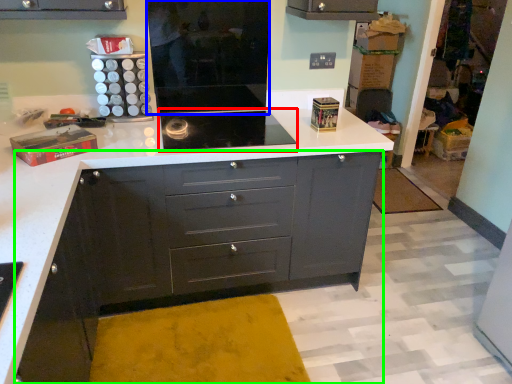
Question: Which object is the farthest from home appliance (highlighted by a red box)? Choose among these: appliance (highlighted by a blue box) or chest of drawers (highlighted by a green box).

Choices:
 (A) appliance
 (B) chest of drawers

Answer: (B)